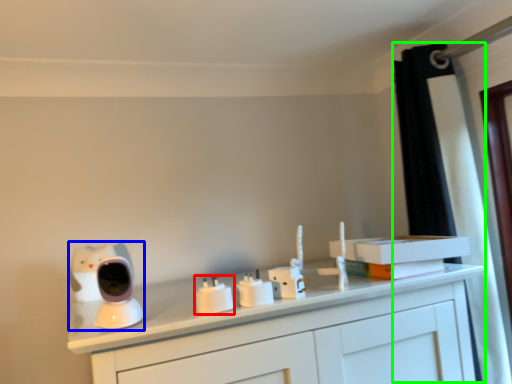
Question: Which object is positioned closest to electric outlet (highlighted by a red box)? Select from toy (highlighted by a blue box) and curtain (highlighted by a green box).

Choices:
 (A) toy
 (B) curtain

Answer: (A)